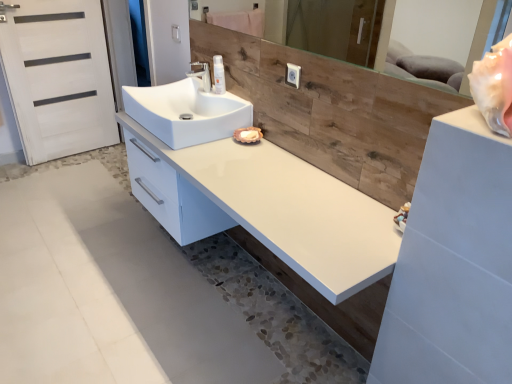
Where is `blank space above white glossy counter at center (from a real-world perspective)`? blank space above white glossy counter at center (from a real-world perspective) is located at coordinates (251, 169).